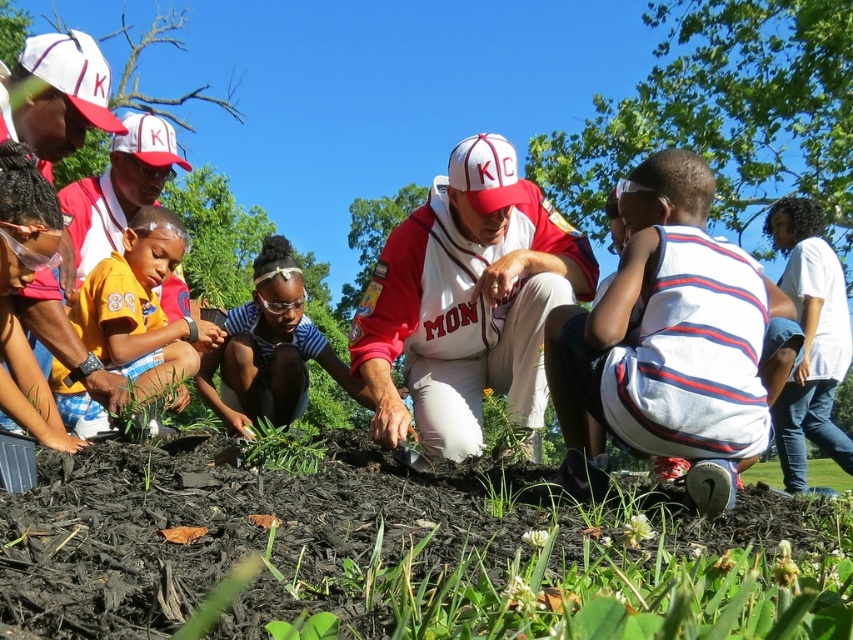
Is point (560, 424) closer to camera compared to point (317, 458)?

That is False.

Is point (698, 490) closer to viewer compared to point (306, 451)?

Yes, point (698, 490) is closer to viewer.

You are a GUI agent. You are given a task and a screenshot of the screen. Output one action in this format:
    pyautogui.click(x=<x>, y=<y>)
    Task: Click on the white striped shirt at lower right
    The width and height of the screenshot is (853, 640).
    Given the screenshot: What is the action you would take?
    pyautogui.click(x=666, y=342)

Which is more to the right, green leafy tree at upper center or white cotton shirt at center?

From the viewer's perspective, green leafy tree at upper center appears more on the right side.

Between green leafy tree at upper center and white cotton shirt at center, which one is positioned lower?

Positioned lower is white cotton shirt at center.

The image size is (853, 640). In order to click on green leafy tree at upper center in this screenshot , I will do `click(726, 115)`.

Is green leafy tree at upper center further to the viewer compared to yellow jersey at left?

Yes.

Between green leafy tree at upper center and yellow jersey at left, which one has less height?

yellow jersey at left

Is point (619, 128) closer to camera compared to point (102, 296)?

No, (619, 128) is behind (102, 296).

This screenshot has height=640, width=853. Find the location of `green leafy tree at upper center`. green leafy tree at upper center is located at coordinates (726, 115).